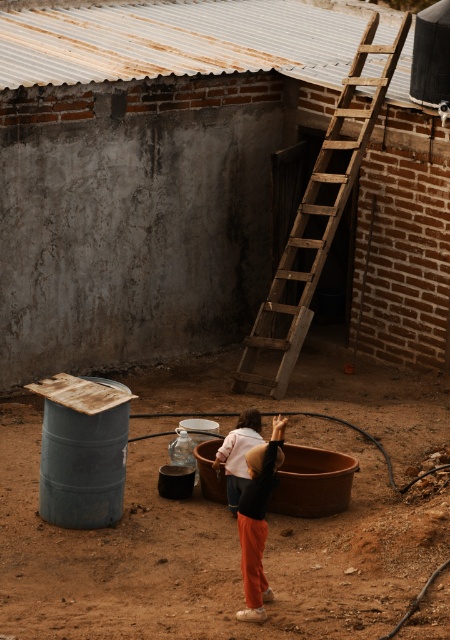
Question: Which is farther from the matte black shirt at center?

Choices:
 (A) wooden at right
 (B) matte pink sweater at center
 (C) rusty metal ladder at upper center

Answer: (C)

Question: Does rusty metal ladder at upper center come behind matte pink sweater at center?

Choices:
 (A) yes
 (B) no

Answer: (A)

Question: Which of the following is the closest to the observer?

Choices:
 (A) (392, 204)
 (B) (413, 532)
 (C) (252, 356)

Answer: (B)

Question: Does brown dirt field at center lie in front of matte pink sweater at center?

Choices:
 (A) yes
 (B) no

Answer: (A)

Question: Does brown dirt field at center have a greater width compared to matte pink sweater at center?

Choices:
 (A) yes
 (B) no

Answer: (A)

Question: Which object is farther from the camera taking this photo?

Choices:
 (A) rusty metal ladder at upper center
 (B) matte black shirt at center
 (C) brown dirt field at center

Answer: (A)